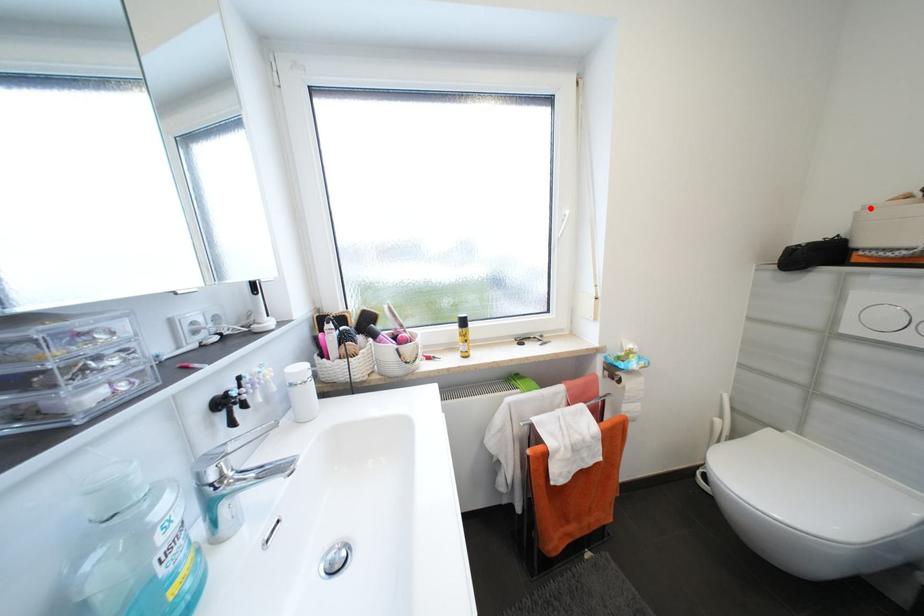
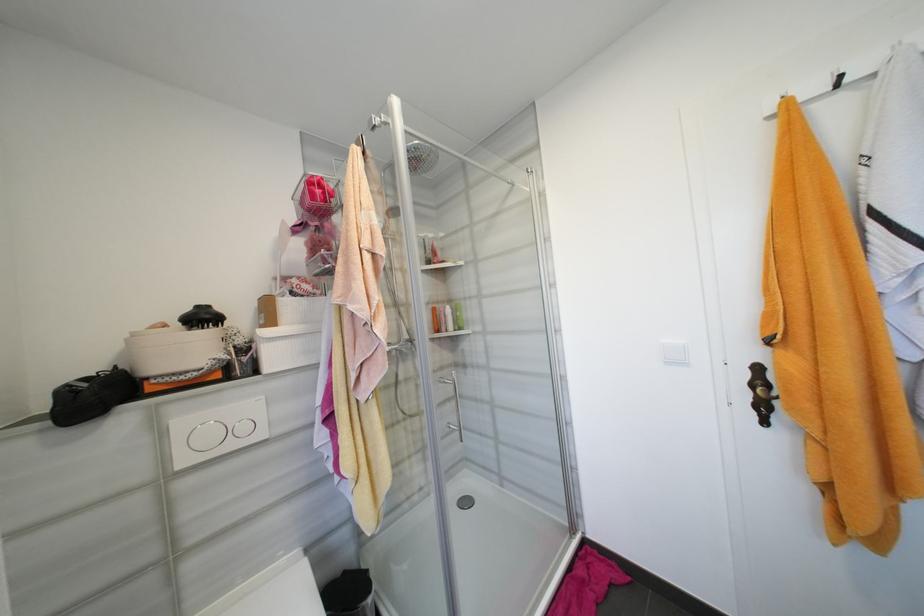
Question: I am providing you with two images of the same scene from different viewpoints. A red point is marked on the first image. Can you still see the location of the red point in image 2?

Choices:
 (A) Yes
 (B) No

Answer: (A)